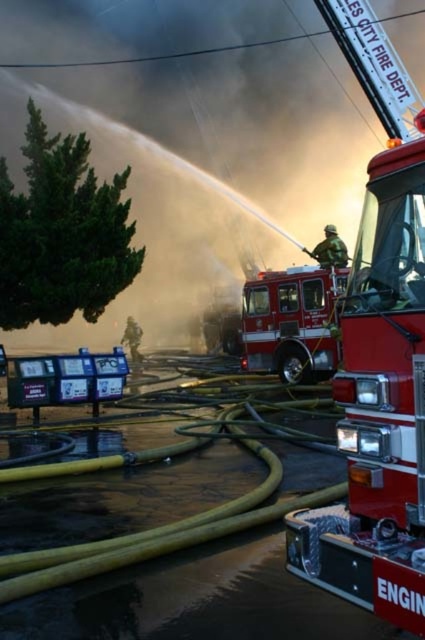
You are a firefighter trying to reach the fire. You see the yellow rubber hose at center and the shiny red fire truck at center. Which object is closer to you?

The yellow rubber hose at center is closer to the viewer than the shiny red fire truck at center.

You are a firefighter trying to locate the fire truck and hose in the scene. Based on the image, which object is bigger in size between the yellow rubber hose at center and the shiny red fire truck at center?

The yellow rubber hose at center has a larger size compared to the shiny red fire truck at center, so the yellow rubber hose at center is bigger in size.

You are a firefighter trying to navigate through the scene. There are two critical points marked in the image. Which point, point (107, 561) or point (323, 244), is closer to you?

Point (107, 561) is closer to the camera than point (323, 244).